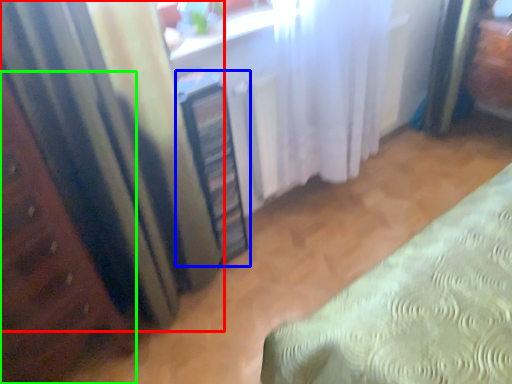
Question: Based on their relative distances, which object is nearer to curtain (highlighted by a red box)? Choose from cabinetry (highlighted by a blue box) and furniture (highlighted by a green box).

Choices:
 (A) cabinetry
 (B) furniture

Answer: (B)